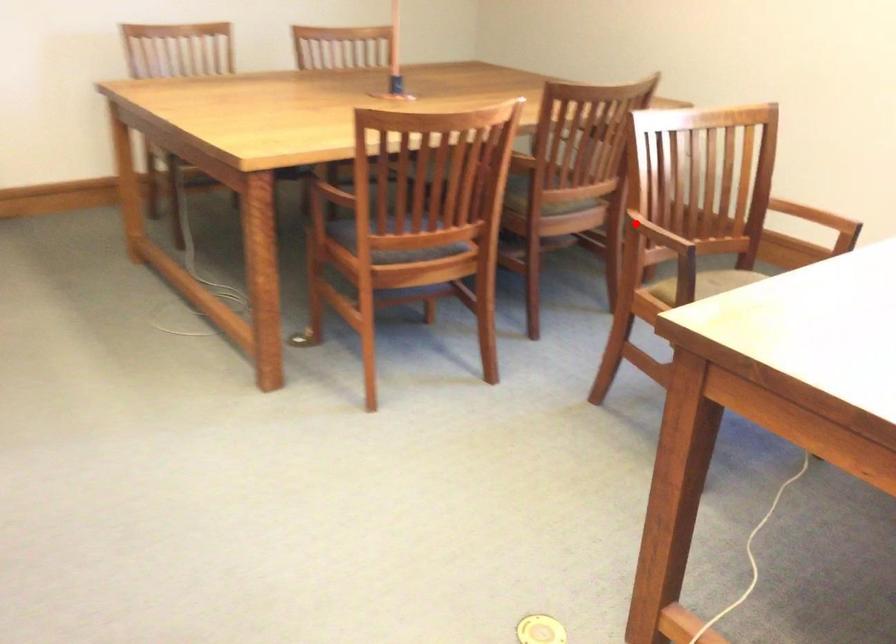
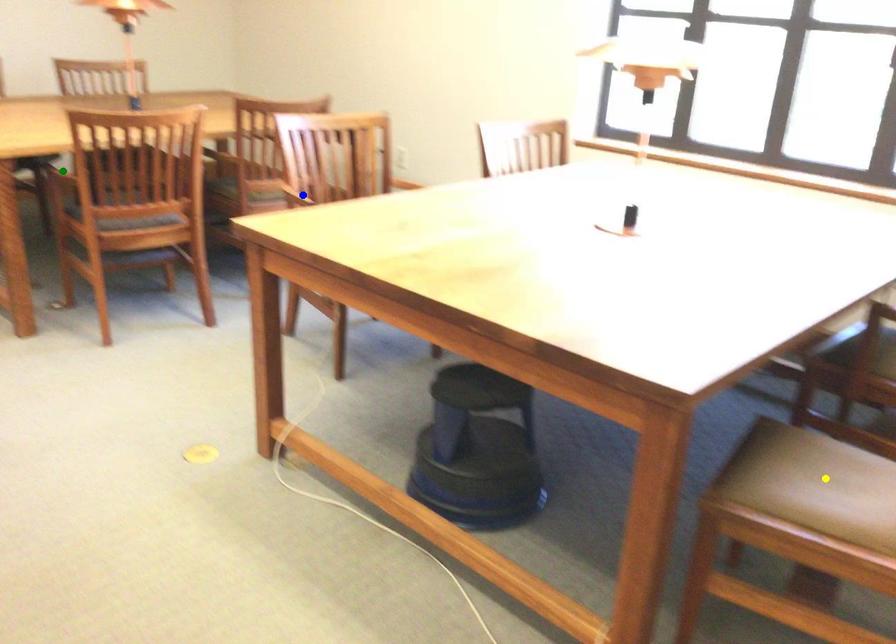
Question: I am providing you with two images of the same scene from different viewpoints. A red point is marked on the first image. You are given multiple points on the second image. Which mark in image 2 goes with the point in image 1?

Choices:
 (A) green point
 (B) blue point
 (C) yellow point

Answer: (B)